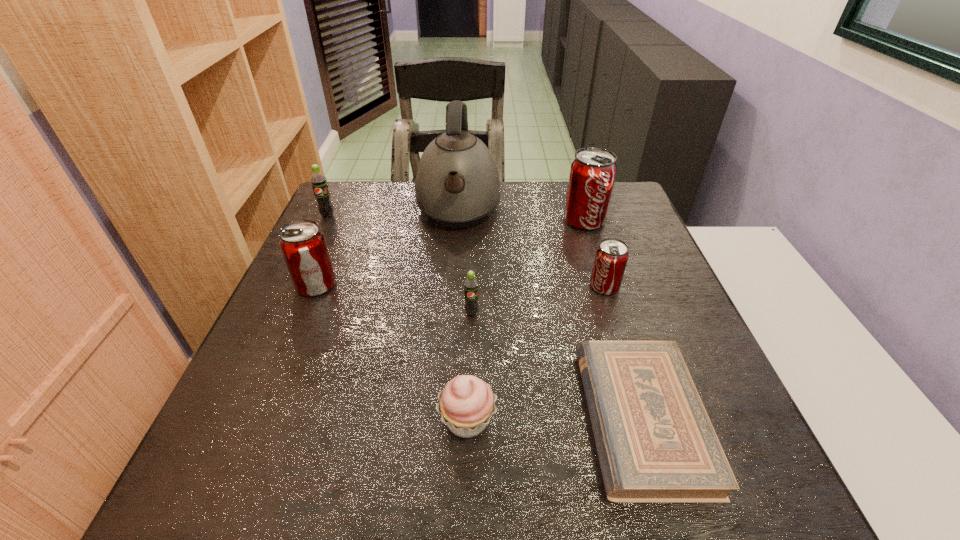
Identify the location of vacant space at the near edge of the desktop. The height and width of the screenshot is (540, 960). (370, 480).

Locate an element on the screen. This screenshot has width=960, height=540. free space at the left edge of the desktop is located at coordinates (311, 416).

Identify the location of vacant space at the right edge of the desktop. (688, 368).

At what (x,y) coordinates should I click in order to perform the action: click on vacant space at the far left corner of the desktop. Please return your answer as a coordinate pair (x, y). Looking at the image, I should click on (351, 213).

This screenshot has width=960, height=540. In order to click on free space at the near left corner of the desktop in this screenshot , I will do `click(224, 504)`.

I want to click on empty space between the kettle and the farthest red pop soda, so (x=521, y=216).

Find the location of `free space between the leftmost red pop soda and the blue Bible`. free space between the leftmost red pop soda and the blue Bible is located at coordinates (479, 352).

This screenshot has width=960, height=540. Identify the location of vacant area that lies between the gray kettle and the farthest red pop soda. (521, 216).

Identify the location of vacant region between the kettle and the smallest red pop soda. (531, 249).

Locate an element on the screen. free space between the pink cupcake and the farthest red pop soda is located at coordinates (526, 320).